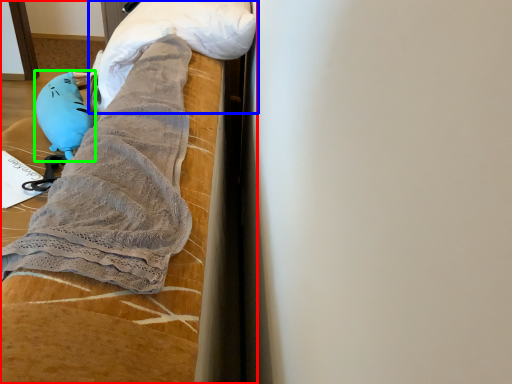
Question: Based on their relative distances, which object is farther from furniture (highlighted by a red box)? Choose from wrap (highlighted by a blue box) and toy (highlighted by a green box).

Choices:
 (A) wrap
 (B) toy

Answer: (B)